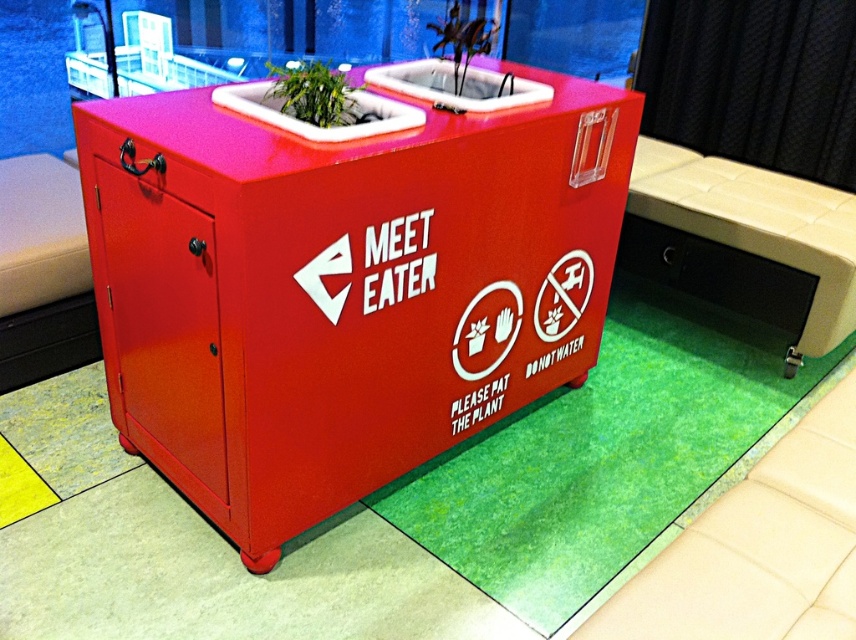
Question: Is matte red cooler at center bigger than green matte plant at upper center?

Choices:
 (A) yes
 (B) no

Answer: (A)

Question: Which point is farther from the camera taking this photo?

Choices:
 (A) (93, 225)
 (B) (342, 124)
 (C) (453, 35)

Answer: (C)

Question: Does matte red cooler at center have a larger size compared to green leafy plant at upper center?

Choices:
 (A) no
 (B) yes

Answer: (B)

Question: Does matte red cooler at center appear over green leafy plant at upper center?

Choices:
 (A) no
 (B) yes

Answer: (A)

Question: Which of these objects is positioned farthest from the green leafy plant at upper center?

Choices:
 (A) green matte plant at upper center
 (B) matte red cooler at center

Answer: (B)

Question: Which point is closer to the camera taking this photo?

Choices:
 (A) (449, 33)
 (B) (284, 96)
 (C) (302, 356)

Answer: (C)